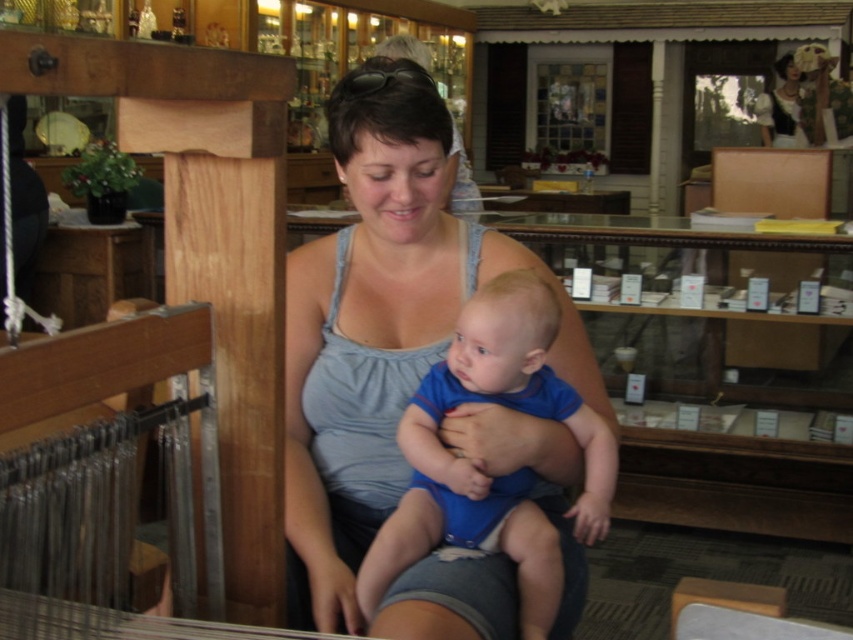
Question: Which of these objects is positioned closest to the matte black dress at upper right?

Choices:
 (A) gray fabric tank top at center
 (B) blue cotton onesie at center

Answer: (A)

Question: Does blue cotton onesie at center appear on the right side of matte black dress at upper right?

Choices:
 (A) no
 (B) yes

Answer: (A)

Question: Considering the relative positions of gray fabric tank top at center and matte black dress at upper right in the image provided, where is gray fabric tank top at center located with respect to matte black dress at upper right?

Choices:
 (A) left
 (B) right

Answer: (A)

Question: Can you confirm if gray fabric tank top at center is bigger than blue cotton onesie at center?

Choices:
 (A) yes
 (B) no

Answer: (A)

Question: Which point is farther from the camera taking this photo?

Choices:
 (A) (585, 451)
 (B) (786, 70)

Answer: (B)

Question: Which point is closer to the camera taking this photo?

Choices:
 (A) (410, 252)
 (B) (413, 492)
 (C) (759, 122)

Answer: (B)